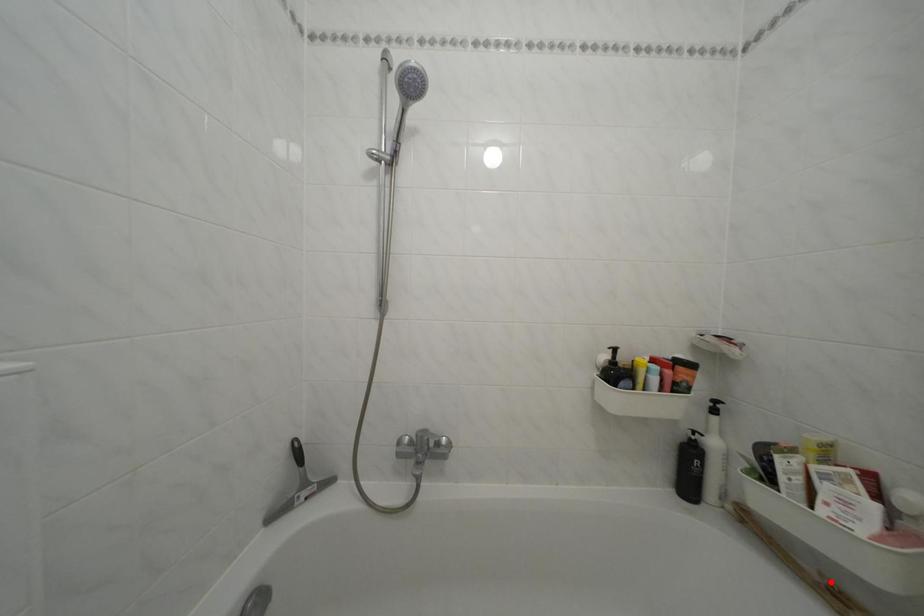
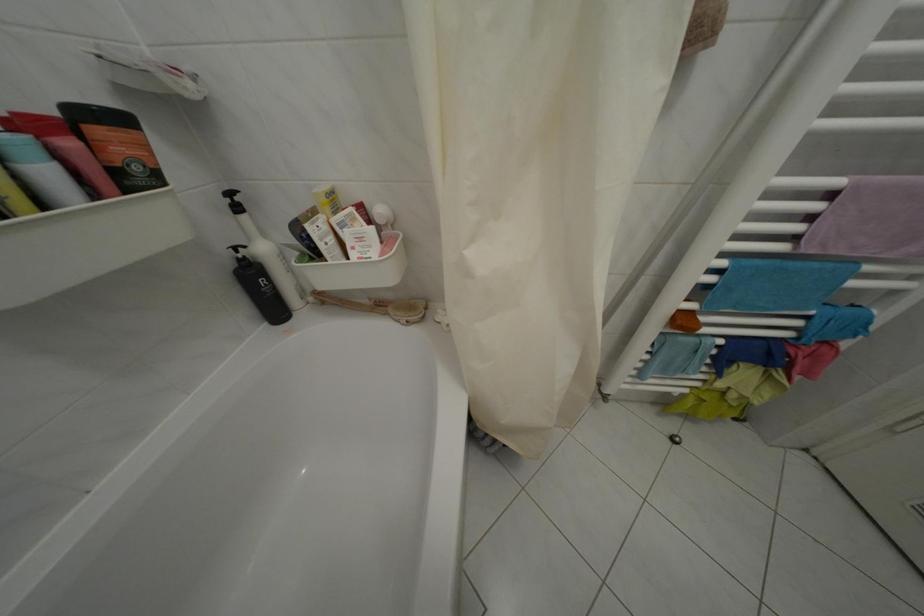
Question: I am providing you with two images of the same scene from different viewpoints. Given a red point in image1, look at the same physical point in image2. Is it:

Choices:
 (A) Closer to the viewpoint
 (B) Farther from the viewpoint

Answer: (A)